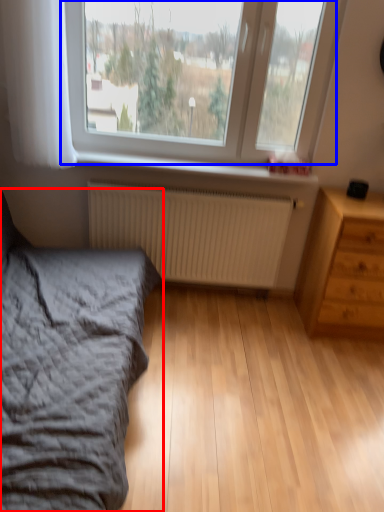
Question: Which object appears closest to the camera in this image, bed (highlighted by a red box) or window (highlighted by a blue box)?

Choices:
 (A) bed
 (B) window

Answer: (A)